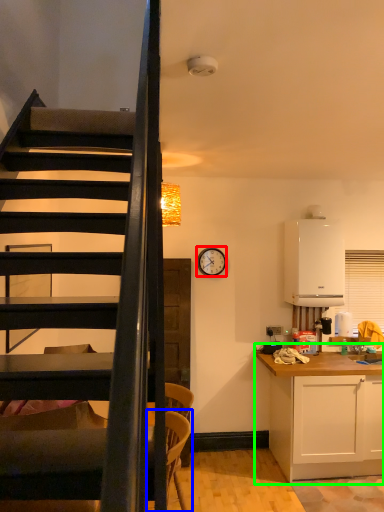
Question: Considering the real-world distances, which object is closest to clock (highlighted by a red box)? armchair (highlighted by a blue box) or cabinetry (highlighted by a green box).

Choices:
 (A) armchair
 (B) cabinetry

Answer: (B)